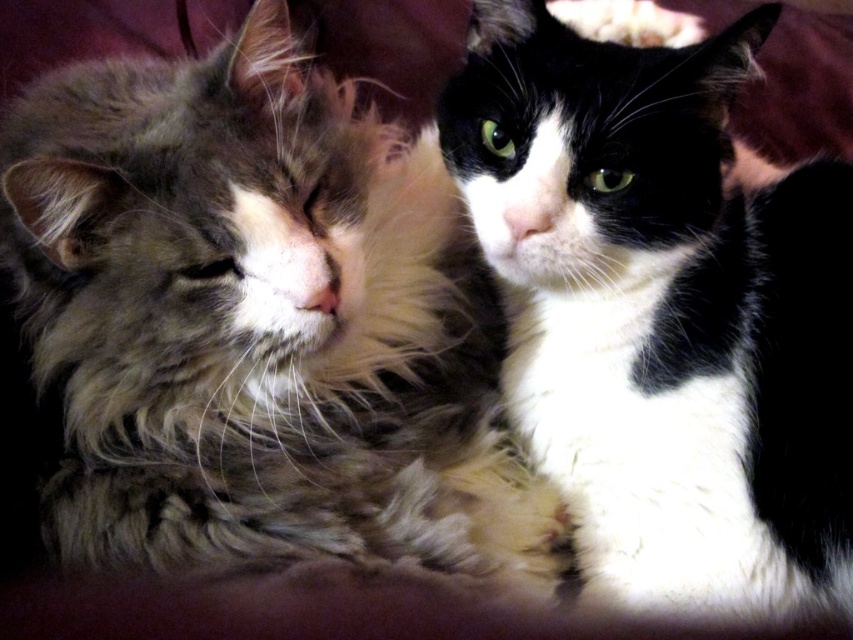
Question: Considering the relative positions of fluffy fur cat at center and black and white fur cat at center in the image provided, where is fluffy fur cat at center located with respect to black and white fur cat at center?

Choices:
 (A) below
 (B) above

Answer: (A)

Question: Is fluffy fur cat at center below black and white fur cat at center?

Choices:
 (A) no
 (B) yes

Answer: (B)

Question: Which point is farther from the camera taking this photo?

Choices:
 (A) (410, 225)
 (B) (686, 368)

Answer: (A)

Question: Which object is closer to the camera taking this photo?

Choices:
 (A) black and white fur cat at center
 (B) fluffy fur cat at center

Answer: (B)

Question: Can you confirm if fluffy fur cat at center is smaller than black and white fur cat at center?

Choices:
 (A) yes
 (B) no

Answer: (B)